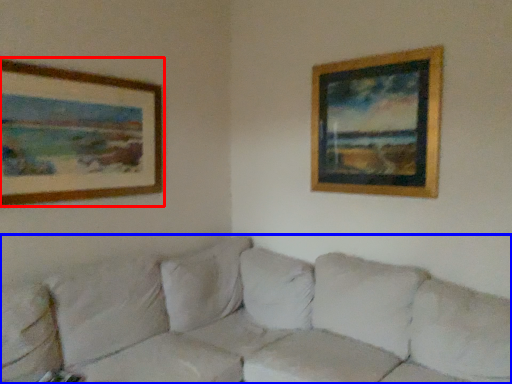
Question: Among these objects, which one is farthest to the camera, picture frame (highlighted by a red box) or studio couch (highlighted by a blue box)?

Choices:
 (A) picture frame
 (B) studio couch

Answer: (A)